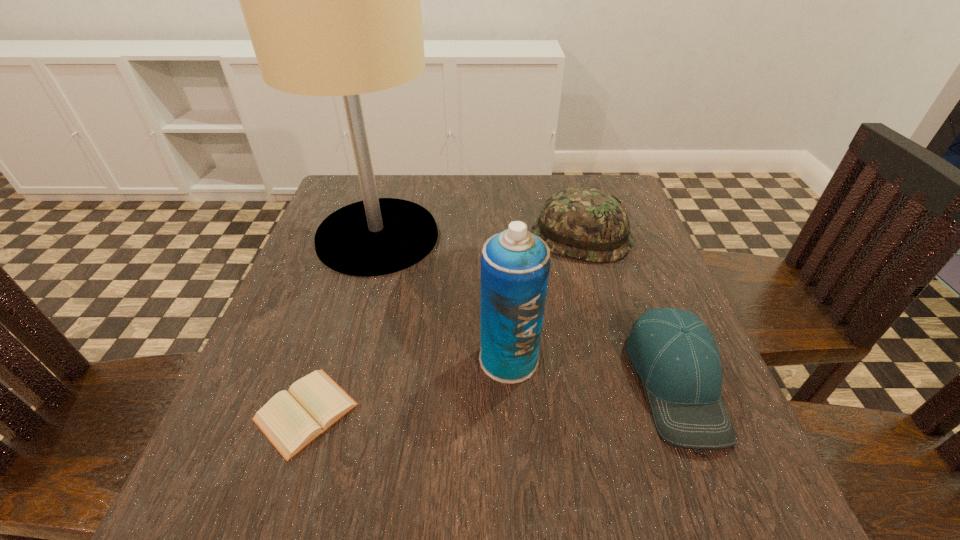
This screenshot has height=540, width=960. In order to click on the tallest object in this screenshot , I will do `click(331, 0)`.

The width and height of the screenshot is (960, 540). Find the location of `the fourth shortest object`. the fourth shortest object is located at coordinates (515, 264).

The image size is (960, 540). I want to click on the third object from left to right, so click(515, 264).

Locate an element on the screen. the third tallest object is located at coordinates (584, 223).

You are a GUI agent. You are given a task and a screenshot of the screen. Output one action in this format:
    pyautogui.click(x=<x>, y=<y>)
    Task: Click on the baseball cap
    The width and height of the screenshot is (960, 540).
    Given the screenshot: What is the action you would take?
    point(674,353)

What are the coordinates of `diary` in the screenshot? It's located at (290, 421).

The width and height of the screenshot is (960, 540). I want to click on vacant region located 0.280m on the front of the table lamp, so click(x=333, y=393).

At what (x,y) coordinates should I click in order to perform the action: click on vacant position located 0.220m on the right of the fourth shortest object. Please return your answer as a coordinate pair (x, y). Looking at the image, I should click on (666, 359).

You are a GUI agent. You are given a task and a screenshot of the screen. Output one action in this format:
    pyautogui.click(x=<x>, y=<y>)
    Task: Click on the vacant position located 0.060m on the left of the third shortest object
    This screenshot has height=540, width=960.
    Given the screenshot: What is the action you would take?
    pyautogui.click(x=507, y=237)

I want to click on vacant area situated on the left of the baseball cap, so click(x=518, y=381).